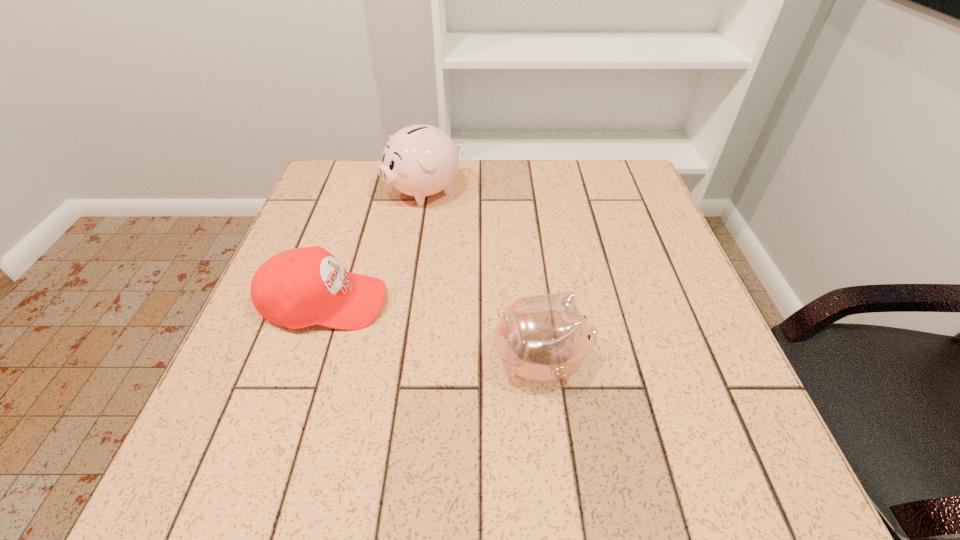
Image resolution: width=960 pixels, height=540 pixels. I want to click on vacant space that satisfies the following two spatial constraints: 1. on the front side of the farthest object; 2. on the front panel of the baseball cap, so click(407, 303).

Identify the location of vacant space that satisfies the following two spatial constraints: 1. on the front panel of the shortest object; 2. on the front facing side of the nearer piggy bank. (305, 362).

This screenshot has width=960, height=540. What are the coordinates of `free spot that satisfies the following two spatial constraints: 1. on the front panel of the baseball cap; 2. on the front facing side of the right piggy bank` in the screenshot? It's located at (305, 362).

Locate an element on the screen. Image resolution: width=960 pixels, height=540 pixels. free space in the image that satisfies the following two spatial constraints: 1. on the front panel of the baseball cap; 2. on the front facing side of the shorter piggy bank is located at coordinates (305, 362).

Identify the location of free location that satisfies the following two spatial constraints: 1. on the front facing side of the second tallest object; 2. on the front panel of the shortest object. The height and width of the screenshot is (540, 960). (534, 303).

In order to click on vacant region that satisfies the following two spatial constraints: 1. on the front panel of the baseball cap; 2. on the front facing side of the shorter piggy bank in this screenshot , I will do `click(305, 362)`.

At what (x,y) coordinates should I click in order to perform the action: click on free point that satisfies the following two spatial constraints: 1. on the front side of the tallest object; 2. on the front facing side of the rightmost object. Please return your answer as a coordinate pair (x, y). The width and height of the screenshot is (960, 540). Looking at the image, I should click on (397, 362).

The height and width of the screenshot is (540, 960). In order to click on vacant space that satisfies the following two spatial constraints: 1. on the front facing side of the shorter piggy bank; 2. on the front panel of the shortest object in this screenshot , I will do `click(534, 303)`.